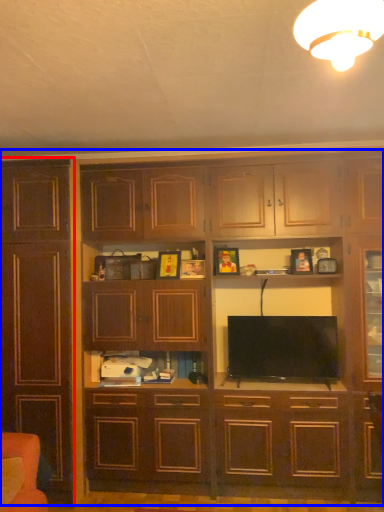
Question: Which object is closer to the camera taking this photo, cabinetry (highlighted by a red box) or cupboard (highlighted by a blue box)?

Choices:
 (A) cabinetry
 (B) cupboard

Answer: (B)